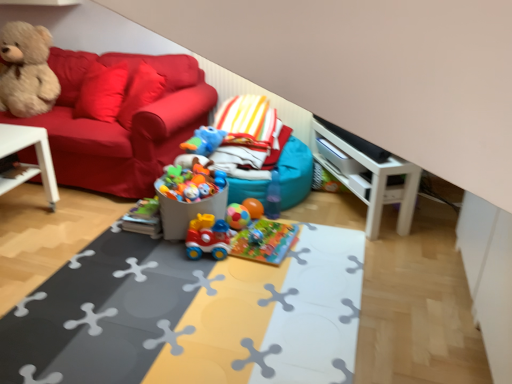
This screenshot has height=384, width=512. Identify the location of rubber ball at center, marked as the 3th toy in a top-to-bottom arrangement. (244, 213).

The width and height of the screenshot is (512, 384). Describe the element at coordinates (261, 152) in the screenshot. I see `teal fabric bean bag at center` at that location.

From the picture: In order to face white plastic table at left, which is the 1th table in left-to-right order, should I rotate leftwards or rightwards?

You should look left and rotate roughly 32.122 degrees.

This screenshot has width=512, height=384. Describe the element at coordinates (28, 164) in the screenshot. I see `white plastic table at left, which is the 1th table in left-to-right order` at that location.

The image size is (512, 384). I want to click on rubber ball at center, marked as the 2th toy in a bottom-to-top arrangement, so click(244, 213).

Is rubber ball at center, marked as the 2th toy in a bottom-to-top arrangement, outside of fluffy beige teddy bear at upper left?

Yes, rubber ball at center, marked as the 2th toy in a bottom-to-top arrangement, is outside of fluffy beige teddy bear at upper left.

Who is bigger, rubber ball at center, marked as the 3th toy in a top-to-bottom arrangement, or fluffy beige teddy bear at upper left?

With larger size is fluffy beige teddy bear at upper left.

Does rubber ball at center, marked as the 3th toy in a top-to-bottom arrangement, have a lesser width compared to fluffy beige teddy bear at upper left?

Indeed, rubber ball at center, marked as the 3th toy in a top-to-bottom arrangement, has a lesser width compared to fluffy beige teddy bear at upper left.

Is rubber ball at center, marked as the 3th toy in a top-to-bottom arrangement, positioned with its back to fluffy beige teddy bear at upper left?

No, rubber ball at center, marked as the 3th toy in a top-to-bottom arrangement, is not facing the opposite direction of fluffy beige teddy bear at upper left.

Where is `the 2nd toy counting from the left of the white glossy entertainment center at right`? This screenshot has height=384, width=512. the 2nd toy counting from the left of the white glossy entertainment center at right is located at coordinates (244, 213).

Who is taller, rubber ball at center, marked as the 3th toy in a top-to-bottom arrangement, or white glossy entertainment center at right?

white glossy entertainment center at right is taller.

From the image's perspective, would you say rubber ball at center, marked as the 3th toy in a top-to-bottom arrangement, is shown under white glossy entertainment center at right?

Indeed, from the image's perspective, rubber ball at center, marked as the 3th toy in a top-to-bottom arrangement, is shown beneath white glossy entertainment center at right.

Considering the points (234, 212) and (374, 179), which point is behind, point (234, 212) or point (374, 179)?

The point (234, 212) is farther.

Can you tell me how much rubberized plastic toy train at center, the 4th toy from the top, and rubberized multicolored balls at center, the 3th toy in the bottom-to-top sequence, differ in facing direction?

The angular difference between rubberized plastic toy train at center, the 4th toy from the top, and rubberized multicolored balls at center, the 3th toy in the bottom-to-top sequence, is 23.2 degrees.

From the image's perspective, is rubberized plastic toy train at center, arranged as the first toy when ordered from the bottom, located above or below rubberized multicolored balls at center, placed as the second toy when sorted from top to bottom?

rubberized plastic toy train at center, arranged as the first toy when ordered from the bottom, is below rubberized multicolored balls at center, placed as the second toy when sorted from top to bottom.

Is rubberized plastic toy train at center, the 4th toy from the top, not within rubberized multicolored balls at center, the 3th toy in the bottom-to-top sequence?

That's correct, rubberized plastic toy train at center, the 4th toy from the top, is outside of rubberized multicolored balls at center, the 3th toy in the bottom-to-top sequence.

Considering the positions of objects rubberized plastic toy train at center, arranged as the first toy when ordered from the bottom, and rubberized multicolored balls at center, placed as the second toy when sorted from top to bottom, in the image provided, who is more to the right, rubberized plastic toy train at center, arranged as the first toy when ordered from the bottom, or rubberized multicolored balls at center, placed as the second toy when sorted from top to bottom,?

Positioned to the right is rubberized multicolored balls at center, placed as the second toy when sorted from top to bottom.

Can you confirm if white glossy entertainment center at right is positioned to the left of teal fabric bean bag at center?

No, white glossy entertainment center at right is not to the left of teal fabric bean bag at center.

Is white glossy entertainment center at right beside teal fabric bean bag at center?

No.

Is white glossy entertainment center at right turned away from teal fabric bean bag at center?

white glossy entertainment center at right is not turned away from teal fabric bean bag at center.

What are the coordinates of `entertainment center in front of the teal fabric bean bag at center` in the screenshot? It's located at (372, 181).

Is teal fabric bean bag at center to the left of rubberized multicolored balls at center, placed as the second toy when sorted from top to bottom, from the viewer's perspective?

Yes.

Which is in front, teal fabric bean bag at center or rubberized multicolored balls at center, placed as the second toy when sorted from top to bottom?

teal fabric bean bag at center is more forward.

Which is correct: teal fabric bean bag at center is inside rubberized multicolored balls at center, placed as the second toy when sorted from top to bottom, or outside of it?

The correct answer is: outside.

Is teal fabric bean bag at center thinner than white plastic table at left, which is the 1th table in left-to-right order?

In fact, teal fabric bean bag at center might be wider than white plastic table at left, which is the 1th table in left-to-right order.

From the image's perspective, which is below, teal fabric bean bag at center or white plastic table at left, which is the 1th table in left-to-right order?

white plastic table at left, which is the 1th table in left-to-right order, appears lower in the image.

In the scene shown: Is teal fabric bean bag at center taller than white plastic table at left, which is counted as the 2th table, starting from the right?

Yes.

Is white plastic table at left, which is counted as the 2th table, starting from the right, spatially inside rubberized plastic play mat at center, the second table positioned from the left, or outside of it?

white plastic table at left, which is counted as the 2th table, starting from the right, is not enclosed by rubberized plastic play mat at center, the second table positioned from the left.

How distant is white plastic table at left, which is the 1th table in left-to-right order, from rubberized plastic play mat at center, the second table positioned from the left?

They are 1.15 meters apart.

Which is in front, white plastic table at left, which is the 1th table in left-to-right order, or rubberized plastic play mat at center, the second table positioned from the left?

rubberized plastic play mat at center, the second table positioned from the left, is more forward.

This screenshot has width=512, height=384. I want to click on table beneath the white plastic table at left, which is counted as the 2th table, starting from the right (from a real-world perspective), so click(190, 311).

Where is `teddy bear on the left side of rubber ball at center, marked as the 2th toy in a bottom-to-top arrangement`? The image size is (512, 384). teddy bear on the left side of rubber ball at center, marked as the 2th toy in a bottom-to-top arrangement is located at coordinates (27, 70).

At what (x,y) coordinates should I click in order to perform the action: click on the 1st toy behind when counting from the white glossy entertainment center at right. Please return your answer as a coordinate pair (x, y). The image size is (512, 384). Looking at the image, I should click on (244, 213).

When comparing their distances from velvet teddy bear at left, does white glossy entertainment center at right or rubber ball at center, marked as the 2th toy in a bottom-to-top arrangement, seem further?

white glossy entertainment center at right.

Based on their spatial positions, is white plastic table at left, which is the 1th table in left-to-right order, or rubber duck at center, the 4th toy in the bottom-to-top sequence, further from rubberized plastic play mat at center, the second table positioned from the left?

white plastic table at left, which is the 1th table in left-to-right order.

Estimate the real-world distances between objects in this image. Which object is closer to rubber ball at center, marked as the 3th toy in a top-to-bottom arrangement, rubberized plastic toy train at center, arranged as the first toy when ordered from the bottom, or velvet teddy bear at left?

rubberized plastic toy train at center, arranged as the first toy when ordered from the bottom, is closer to rubber ball at center, marked as the 3th toy in a top-to-bottom arrangement.

Based on their spatial positions, is velvet teddy bear at left or teal fabric bean bag at center closer to rubberized plastic toy train at center, the 4th toy from the top?

teal fabric bean bag at center is closer to rubberized plastic toy train at center, the 4th toy from the top.

Based on their spatial positions, is white glossy entertainment center at right or rubberized plastic play mat at center, the first table in the right-to-left sequence, further from velvet teddy bear at left?

white glossy entertainment center at right lies further to velvet teddy bear at left than the other object.

Estimate the real-world distances between objects in this image. Which object is closer to rubberized plastic play mat at center, the first table in the right-to-left sequence, rubber ball at center, marked as the 2th toy in a bottom-to-top arrangement, or velvet teddy bear at left?

rubber ball at center, marked as the 2th toy in a bottom-to-top arrangement.

Looking at the image, which one is located closer to velvet teddy bear at left, fluffy beige teddy bear at upper left or rubberized multicolored balls at center, the 3th toy in the bottom-to-top sequence?

fluffy beige teddy bear at upper left is positioned closer to the anchor velvet teddy bear at left.

Looking at the image, which one is located further to teal fabric bean bag at center, white plastic table at left, which is the 1th table in left-to-right order, or white glossy entertainment center at right?

Based on the image, white plastic table at left, which is the 1th table in left-to-right order, appears to be further to teal fabric bean bag at center.

I want to click on toy between white plastic table at left, which is the 1th table in left-to-right order, and rubberized plastic toy train at center, arranged as the first toy when ordered from the bottom, from left to right, so click(x=204, y=141).

In order to click on bean bag chair between white plastic table at left, which is counted as the 2th table, starting from the right, and white glossy entertainment center at right from left to right in this screenshot , I will do `click(261, 152)`.

Find the location of a particular element. studio couch located between fluffy beige teddy bear at upper left and rubberized plastic toy train at center, the 4th toy from the top, in the left-right direction is located at coordinates (121, 117).

You are a GUI agent. You are given a task and a screenshot of the screen. Output one action in this format:
    pyautogui.click(x=<x>, y=<y>)
    Task: Click on the entertainment center between rubberized plastic play mat at center, the second table positioned from the left, and rubberized multicolored balls at center, placed as the second toy when sorted from top to bottom, from front to back
    The height and width of the screenshot is (384, 512).
    Given the screenshot: What is the action you would take?
    pyautogui.click(x=372, y=181)